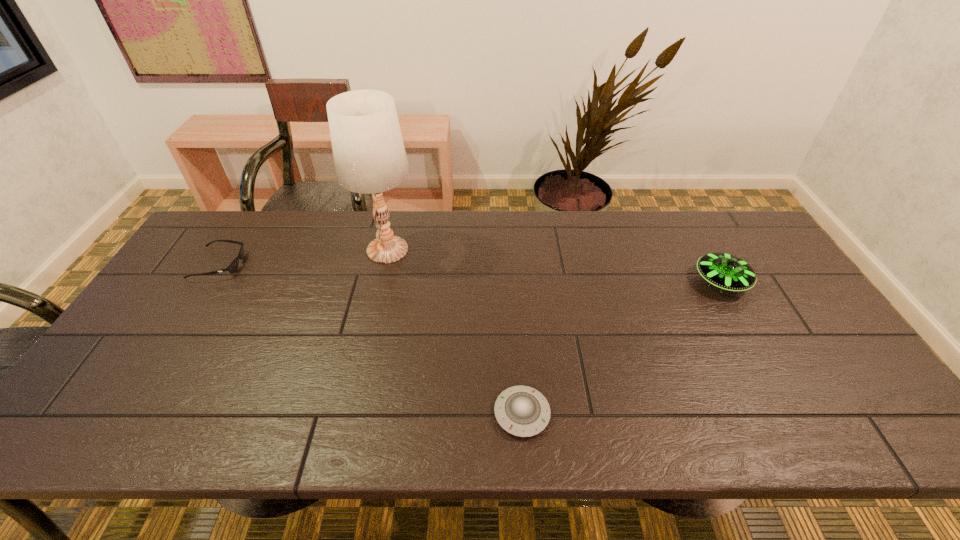
Identify the location of vacant space located on the front-facing side of the third tallest object. (369, 265).

The image size is (960, 540). I want to click on vacant space situated on the left of the shorter saucer, so click(x=326, y=414).

You are a GUI agent. You are given a task and a screenshot of the screen. Output one action in this format:
    pyautogui.click(x=<x>, y=<y>)
    Task: Click on the lamp at the far edge
    The width and height of the screenshot is (960, 540).
    Given the screenshot: What is the action you would take?
    pyautogui.click(x=369, y=155)

Locate an element on the screen. sunglasses that is positioned at the far edge is located at coordinates click(x=233, y=266).

This screenshot has width=960, height=540. What are the coordinates of `object at the near edge` in the screenshot? It's located at (522, 411).

Where is `object that is positioned at the left edge`? The width and height of the screenshot is (960, 540). object that is positioned at the left edge is located at coordinates (233, 266).

Identify the location of object positioned at the right edge. (728, 272).

Find the location of `object that is at the far left corner`. object that is at the far left corner is located at coordinates (233, 266).

Find the location of a particular element. vacant space at the far edge of the desktop is located at coordinates (438, 248).

Find the location of a particular element. blank space at the near edge of the desktop is located at coordinates (574, 424).